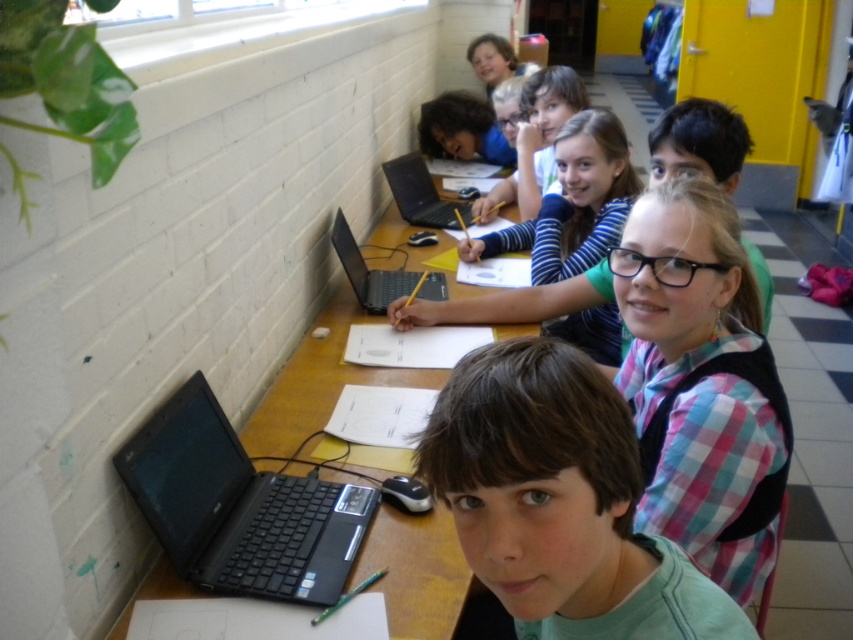
You are a teacher in the classroom. You need to place a new laptop on the wooden table at center and the pink plaid shirt at center. Which object can accommodate a larger laptop?

The wooden table at center has a larger size compared to the pink plaid shirt at center, so the wooden table at center can accommodate a larger laptop.

You are a teacher standing at the yellow door and want to walk to the point at the center of the two points, point (405, 589) and point (405, 220). Which direction should you walk to reach the midpoint between them?

Since point (405, 589) is in front of point (405, 220), the midpoint between them would be directly in front of point (405, 220). Therefore, you should walk towards the front direction from your current position at the yellow door to reach the midpoint.

You are a student trying to place your backpack on the wooden table at center. The backpack is as big as the black matte laptop at center. Will it fit on the table?

The wooden table at center is larger in size than the black matte laptop at center, so the backpack, which is the same size as the laptop, should fit on the table.